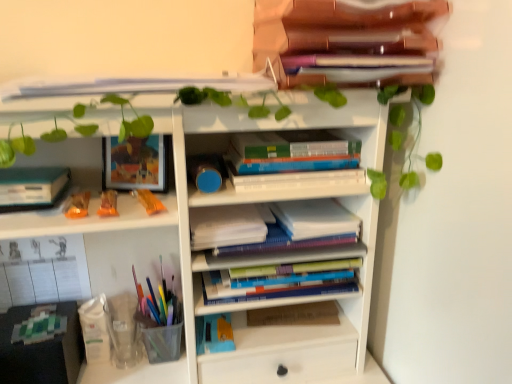
Question: Is hardcover books at center, which is counted as the 1th book, starting from the bottom, completely or partially outside of hardcover books at center, marked as the 2th book in a top-to-bottom arrangement?

Choices:
 (A) no
 (B) yes

Answer: (B)

Question: Could you tell me if hardcover books at center, which is counted as the 1th book, starting from the bottom, is turned towards hardcover books at center, marked as the 2th book in a top-to-bottom arrangement?

Choices:
 (A) no
 (B) yes

Answer: (A)

Question: Would you consider hardcover books at center, positioned as the fourth book in top-to-bottom order, to be distant from hardcover books at center, marked as the 2th book in a top-to-bottom arrangement?

Choices:
 (A) yes
 (B) no

Answer: (B)

Question: From a real-world perspective, is hardcover books at center, positioned as the fourth book in top-to-bottom order, physically above hardcover books at center, marked as the 2th book in a top-to-bottom arrangement?

Choices:
 (A) yes
 (B) no

Answer: (B)

Question: Considering the relative positions of hardcover books at center, positioned as the fourth book in top-to-bottom order, and hardcover books at center, marked as the 2th book in a top-to-bottom arrangement, in the image provided, is hardcover books at center, positioned as the fourth book in top-to-bottom order, behind hardcover books at center, marked as the 2th book in a top-to-bottom arrangement,?

Choices:
 (A) no
 (B) yes

Answer: (B)

Question: From the image's perspective, is hardcover books at center, positioned as the fourth book in top-to-bottom order, beneath hardcover books at center, which appears as the third book when ordered from the bottom?

Choices:
 (A) yes
 (B) no

Answer: (A)

Question: Can white matte bookshelf at center be found inside hardcover books at center, which appears as the third book when ordered from the bottom?

Choices:
 (A) yes
 (B) no

Answer: (B)

Question: From the image's perspective, does hardcover books at center, which appears as the third book when ordered from the bottom, appear higher than white matte bookshelf at center?

Choices:
 (A) no
 (B) yes

Answer: (B)

Question: From the image's perspective, is hardcover books at center, marked as the 2th book in a top-to-bottom arrangement, located beneath white matte bookshelf at center?

Choices:
 (A) no
 (B) yes

Answer: (A)

Question: Can you confirm if hardcover books at center, which appears as the third book when ordered from the bottom, is smaller than white matte bookshelf at center?

Choices:
 (A) no
 (B) yes

Answer: (B)

Question: Can you confirm if hardcover books at center, marked as the 2th book in a top-to-bottom arrangement, is bigger than white matte bookshelf at center?

Choices:
 (A) yes
 (B) no

Answer: (B)

Question: Considering the relative sizes of hardcover books at center, marked as the 2th book in a top-to-bottom arrangement, and white matte bookshelf at center in the image provided, is hardcover books at center, marked as the 2th book in a top-to-bottom arrangement, taller than white matte bookshelf at center?

Choices:
 (A) yes
 (B) no

Answer: (B)

Question: Is translucent orange candy at left, the first toy positioned from the right, at the left side of hardcover books at center, which appears as the third book when ordered from the bottom?

Choices:
 (A) no
 (B) yes

Answer: (B)